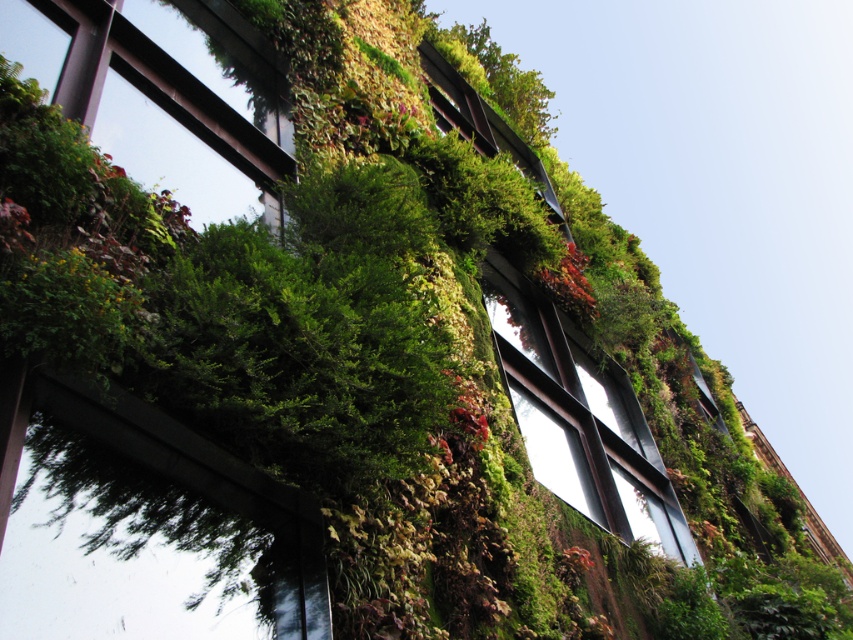
You are an architect reviewing the building facade. You need to determine the vertical arrangement of the metallic glass window at center and the green matte window at upper left. Which one is positioned higher on the building?

The green matte window at upper left is positioned higher on the building than the metallic glass window at center.